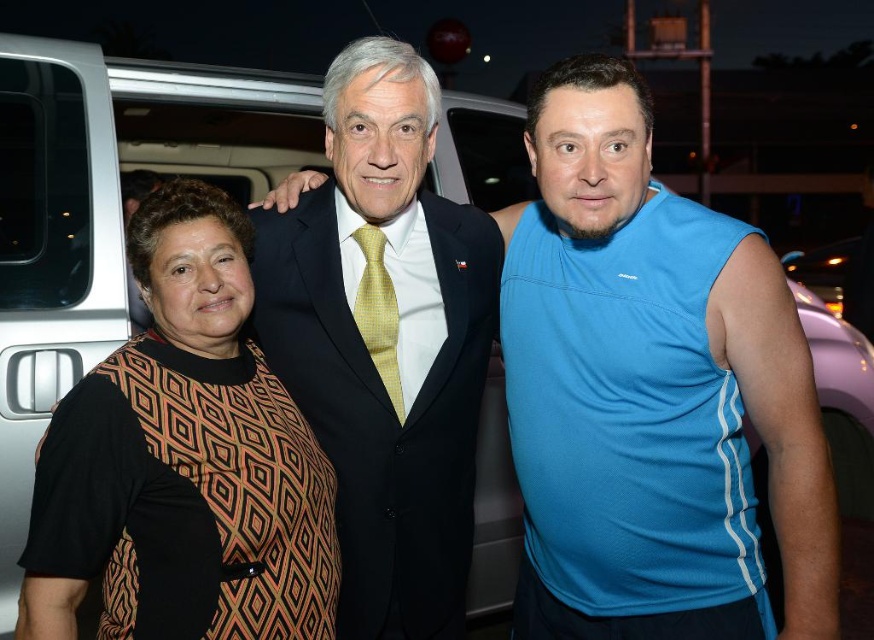
Looking at this image, you are a photographer adjusting the lighting for a group photo. The subjects include a person wearing a blue mesh tank top at center and another in a matte black suit at center. Which clothing item would require more light to ensure proper exposure, and why?

The matte black suit at center requires more light because it absorbs more light and is thicker than the blue mesh tank top at center, making it appear darker in photos without sufficient illumination.

You are a photographer setting up for an outdoor event at night. You have two subjects dressed in a patterned fabric dress at left and a matte black suit at center. Which subject should you adjust your camera focus on first if you want to ensure the taller subject is in focus first?

The matte black suit at center is taller than the patterned fabric dress at left, so you should focus on the matte black suit at center first.

You are a photographer at a nighttime event. You notice the patterned fabric dress at left and the matte black suit at center. Which one is closer to the camera?

The patterned fabric dress at left is closer to the camera because it is in front of the matte black suit at center.